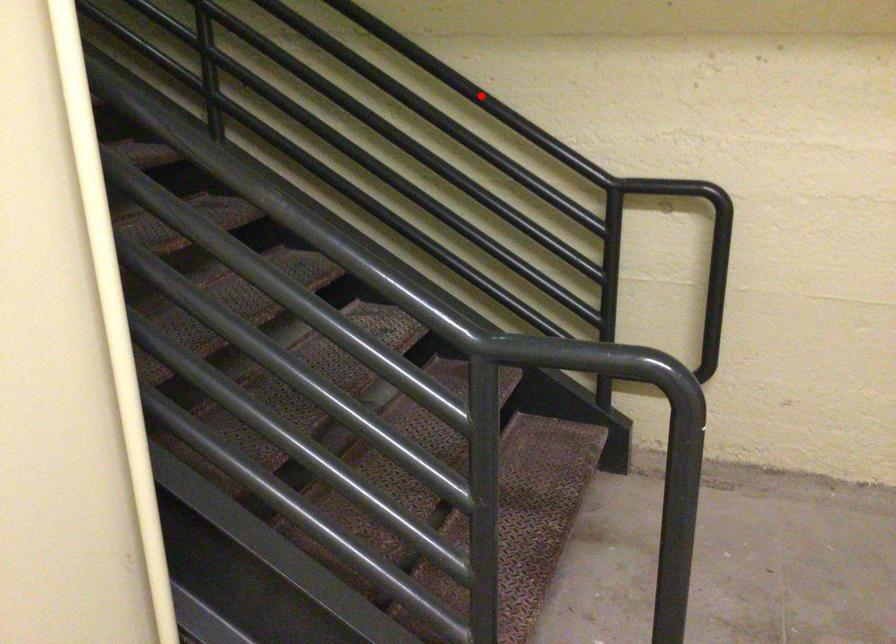
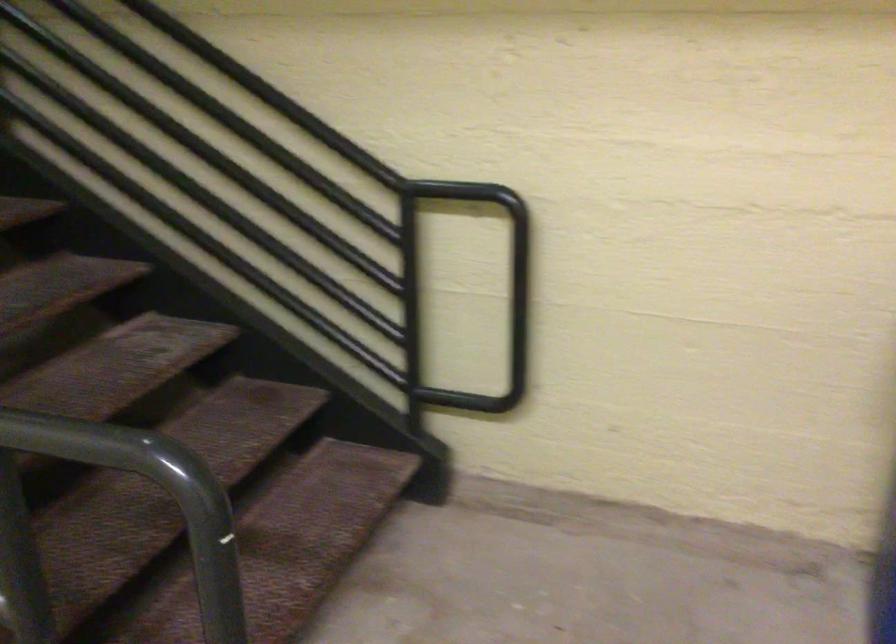
Question: A red point is marked in image1. In image2, is the corresponding 3D point closer to the camera or farther? Reply with the corresponding letter.

Choices:
 (A) The corresponding 3D point is closer.
 (B) The corresponding 3D point is farther.

Answer: (A)